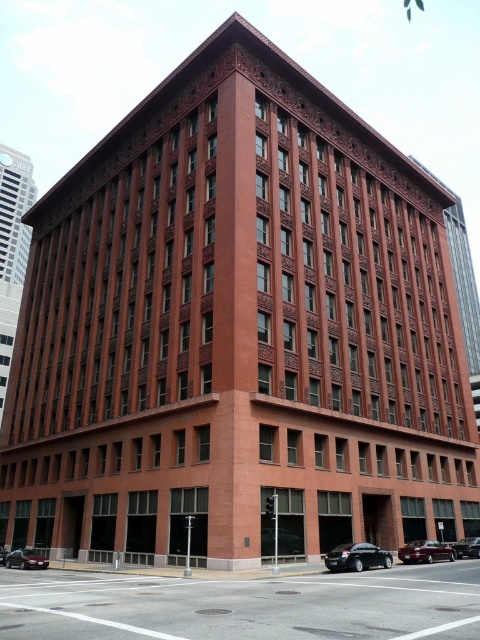
Who is taller, shiny black sedan at center or shiny black sedan at lower left?

shiny black sedan at lower left is taller.

Is point (464, 538) positioned before point (0, 564)?

No, (464, 538) is behind (0, 564).

I want to click on shiny black sedan at center, so click(x=467, y=547).

Does point (13, 561) lie in front of point (469, 550)?

Yes, point (13, 561) is closer to viewer.

This screenshot has height=640, width=480. I want to click on metallic silver car at lower left, so click(x=25, y=557).

Is point (36, 561) positioned behind point (474, 550)?

No, it is not.

Locate an element on the screen. This screenshot has width=480, height=640. metallic silver car at lower left is located at coordinates (25, 557).

Which is above, shiny maroon sedan at lower right or shiny black sedan at lower left?

shiny maroon sedan at lower right is above.

Consider the image. Does shiny maroon sedan at lower right have a smaller size compared to shiny black sedan at lower left?

Actually, shiny maroon sedan at lower right might be larger than shiny black sedan at lower left.

Is point (416, 541) positioned behind point (4, 556)?

No.

Where is `shiny maroon sedan at lower right`? shiny maroon sedan at lower right is located at coordinates (424, 552).